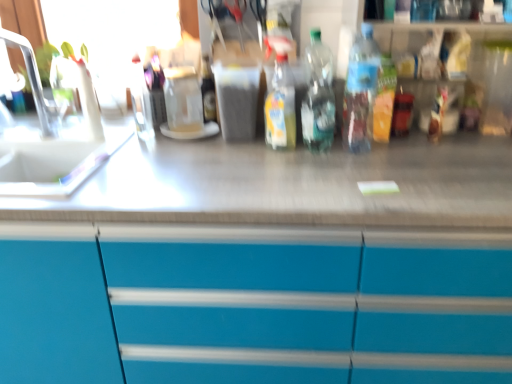
Locate an element on the screen. vacant area to the left of transparent glass jar at center is located at coordinates (124, 135).